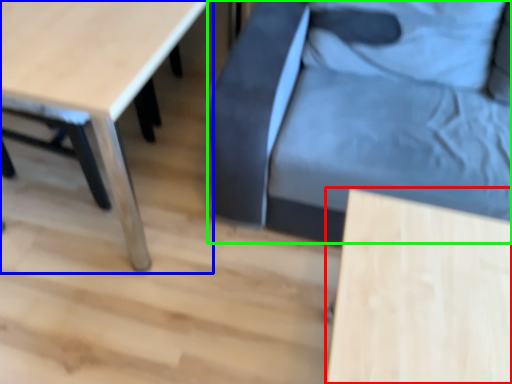
Question: Considering the real-world distances, which object is closest to table (highlighted by a red box)? table (highlighted by a blue box) or swivel chair (highlighted by a green box).

Choices:
 (A) table
 (B) swivel chair

Answer: (B)